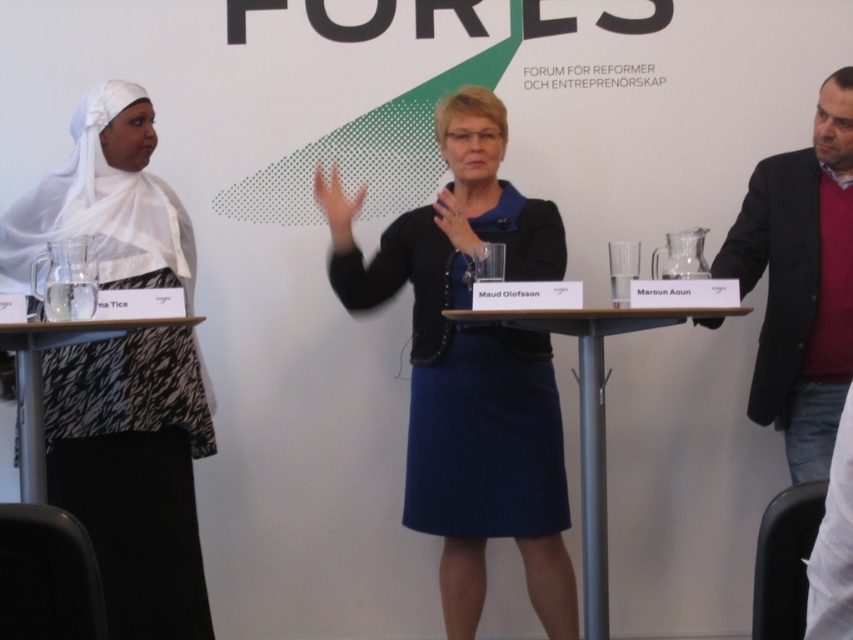
In the scene shown: You are a photographer at the event and need to capture a group photo of the two individuals wearing the white silk hijab at left and the dark gray blazer at right. The camera you have can focus on subjects within a 5 feet range. Can you capture both in a single focused shot?

The white silk hijab at left and dark gray blazer at right are 5.75 feet apart. Since the camera can only focus within a 5 feet range, the distance between them exceeds the camera range. Therefore, you cannot capture both in a single focused shot.

Based on the scene described, which object is positioned to the left of the other between the white silk hijab at left and the dark gray blazer at right?

The white silk hijab at left is positioned to the left of the dark gray blazer at right.

You are attending the Forum for Reformers and Entrepreneurship and want to approach the blue fabric skirt at center. If you can walk 3 feet per second, how many seconds will it take to reach it?

The distance between you and the blue fabric skirt at center is 7.58 feet. At a walking speed of 3 feet per second, it would take approximately 2.53 seconds to reach it.